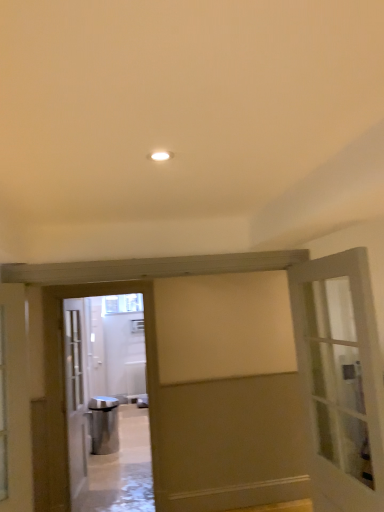
Question: Would you consider silver metallic elevator at center to be distant from clear glass window at center?

Choices:
 (A) yes
 (B) no

Answer: (B)

Question: Is silver metallic elevator at center bigger than clear glass window at center?

Choices:
 (A) no
 (B) yes

Answer: (B)

Question: Is clear glass window at center at the back of silver metallic elevator at center?

Choices:
 (A) yes
 (B) no

Answer: (A)

Question: Does silver metallic elevator at center come behind clear glass window at center?

Choices:
 (A) no
 (B) yes

Answer: (A)

Question: Is silver metallic elevator at center smaller than clear glass window at center?

Choices:
 (A) no
 (B) yes

Answer: (A)

Question: Is silver metallic elevator at center taller than clear glass window at center?

Choices:
 (A) yes
 (B) no

Answer: (A)

Question: Can you confirm if silver metallic elevator at center is bigger than matte gray door at right, acting as the first door starting from the right?

Choices:
 (A) yes
 (B) no

Answer: (B)

Question: From the image's perspective, would you say silver metallic elevator at center is shown under matte gray door at right, the 1th door when ordered from front to back?

Choices:
 (A) yes
 (B) no

Answer: (A)

Question: Is silver metallic elevator at center turned away from matte gray door at right, the 1th door when ordered from front to back?

Choices:
 (A) yes
 (B) no

Answer: (B)

Question: Can you confirm if silver metallic elevator at center is positioned to the left of matte gray door at right, the second door viewed from the left?

Choices:
 (A) no
 (B) yes

Answer: (B)

Question: Is silver metallic elevator at center at the right side of matte gray door at right, the 1th door when ordered from front to back?

Choices:
 (A) yes
 (B) no

Answer: (B)

Question: Is silver metallic elevator at center smaller than matte gray door at right, acting as the first door starting from the right?

Choices:
 (A) yes
 (B) no

Answer: (A)

Question: From a real-world perspective, is white glass door at left, the 1th door when ordered from back to front, physically below silver metallic elevator at center?

Choices:
 (A) no
 (B) yes

Answer: (B)